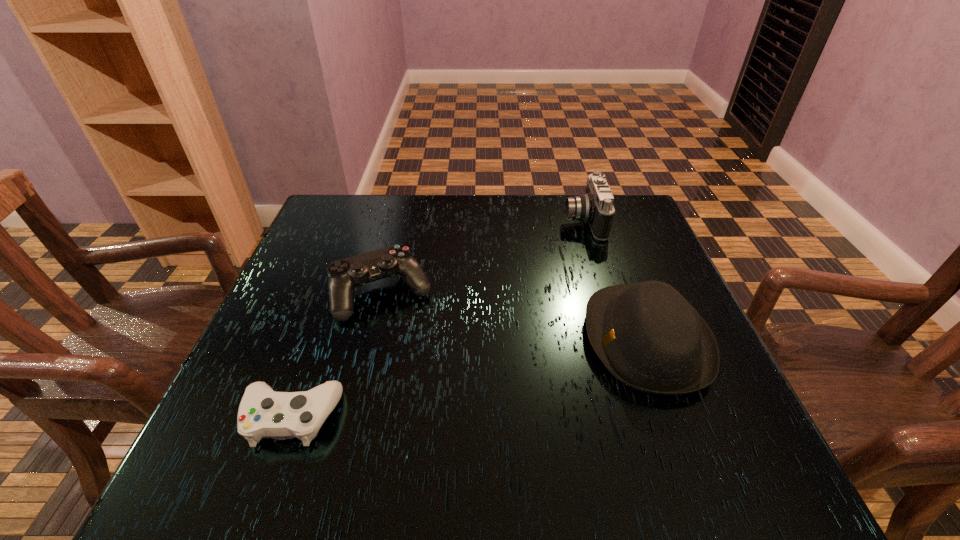
At what (x,y) coordinates should I click in order to perform the action: click on the farthest object. Please return your answer as a coordinate pair (x, y). The height and width of the screenshot is (540, 960). Looking at the image, I should click on (596, 208).

The width and height of the screenshot is (960, 540). In order to click on fedora in this screenshot , I will do `click(649, 337)`.

Locate an element on the screen. the taller control is located at coordinates (344, 275).

Image resolution: width=960 pixels, height=540 pixels. What are the coordinates of `the third tallest object` in the screenshot? It's located at (344, 275).

The image size is (960, 540). I want to click on the shortest object, so click(x=263, y=413).

What are the coordinates of `the nearer control` in the screenshot? It's located at (263, 413).

Identify the location of vacant space located 0.370m on the front-facing side of the camera. This screenshot has height=540, width=960. (428, 222).

I want to click on free space located 0.300m on the front-facing side of the camera, so click(x=454, y=222).

At what (x,y) coordinates should I click in order to perform the action: click on free space located 0.390m on the front-facing side of the camera. Please return your answer as a coordinate pair (x, y). This screenshot has width=960, height=540. Looking at the image, I should click on (420, 222).

At what (x,y) coordinates should I click in order to perform the action: click on free space located 0.390m on the front-facing side of the fedora. Please return your answer as a coordinate pair (x, y). This screenshot has width=960, height=540. Looking at the image, I should click on (389, 340).